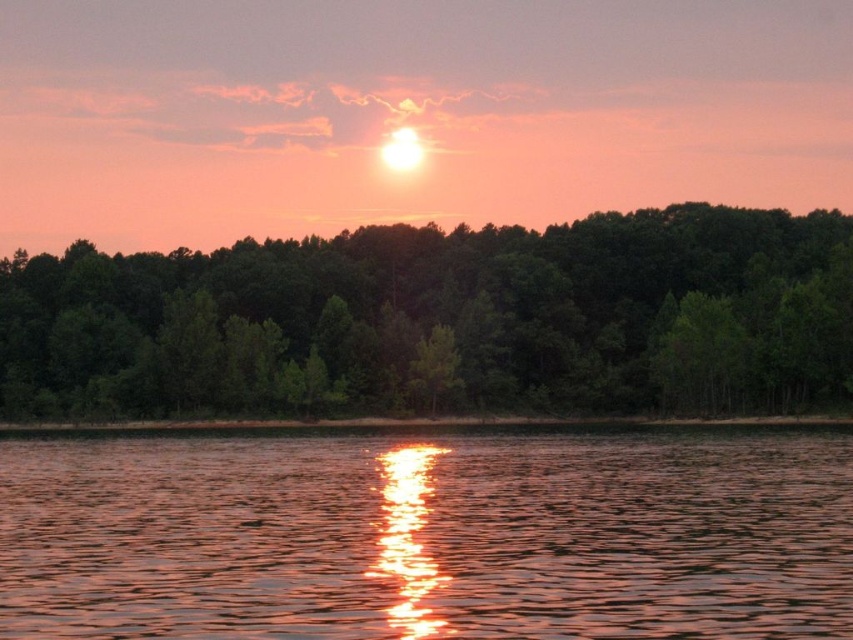
Question: Does glistening water at center have a greater width compared to green matte trees at center?

Choices:
 (A) no
 (B) yes

Answer: (A)

Question: Does glistening water at center have a larger size compared to green matte trees at center?

Choices:
 (A) yes
 (B) no

Answer: (B)

Question: Is glistening water at center to the right of green matte trees at center from the viewer's perspective?

Choices:
 (A) yes
 (B) no

Answer: (A)

Question: Which object appears farthest from the camera in this image?

Choices:
 (A) glistening water at center
 (B) green matte trees at center

Answer: (B)